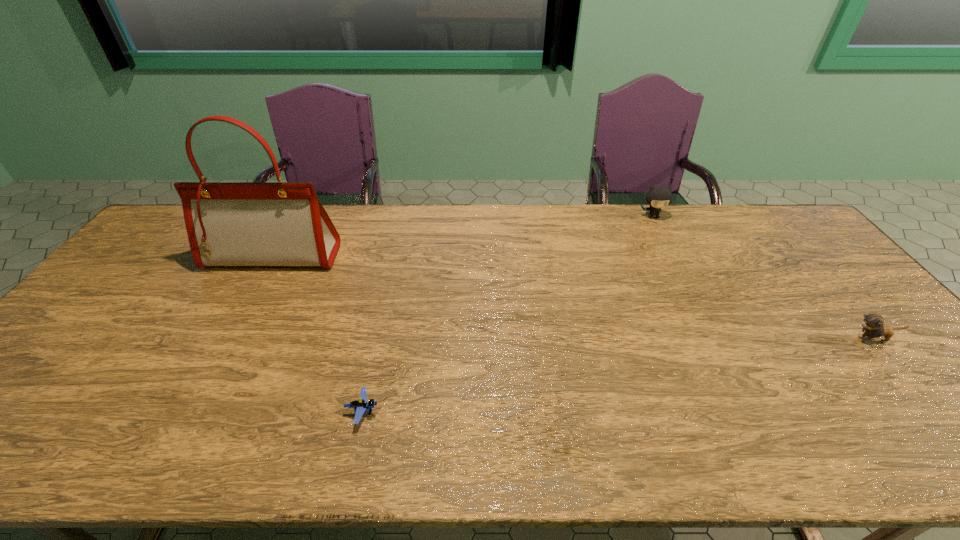
I want to click on the tallest object, so click(x=241, y=224).

Find the location of `the leftmost object`. the leftmost object is located at coordinates (241, 224).

Where is `the left kitten`? The height and width of the screenshot is (540, 960). the left kitten is located at coordinates (657, 197).

Where is `the second tallest object`? the second tallest object is located at coordinates (657, 197).

The height and width of the screenshot is (540, 960). I want to click on the rightmost object, so click(873, 325).

Image resolution: width=960 pixels, height=540 pixels. I want to click on the second shortest object, so click(x=873, y=325).

The width and height of the screenshot is (960, 540). What are the coordinates of `the shortest object` in the screenshot? It's located at (360, 406).

The width and height of the screenshot is (960, 540). I want to click on Lego, so click(360, 406).

Where is `vacant space located on the back of the handbag`? vacant space located on the back of the handbag is located at coordinates (293, 220).

At what (x,y) coordinates should I click in order to perform the action: click on vacant space located on the front-facing side of the farther kitten. Please return your answer as a coordinate pair (x, y). This screenshot has height=540, width=960. Looking at the image, I should click on (663, 238).